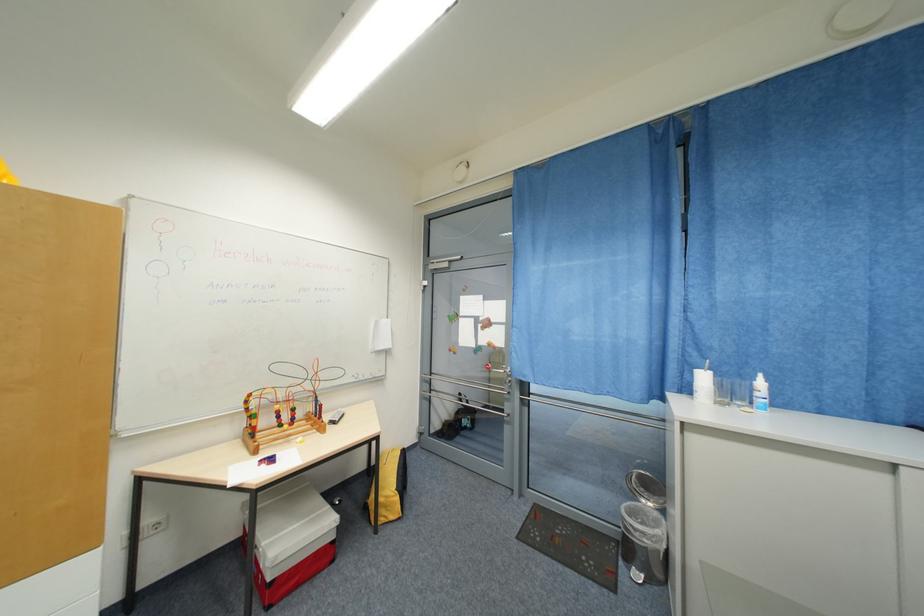
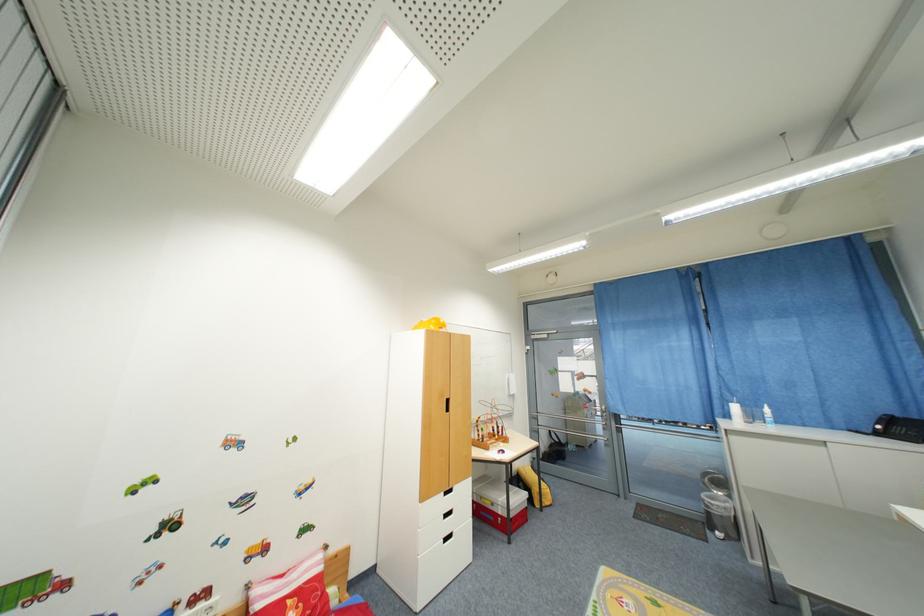
Where in the second image is the point corresponding to [286,427] from the first image?

(500, 438)